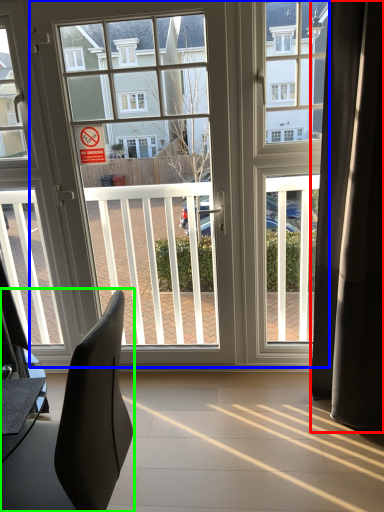
Question: Estimate the real-world distances between objects in this image. Which object is closer to curtain (highlighted by a red box), door (highlighted by a blue box) or chair (highlighted by a green box)?

Choices:
 (A) door
 (B) chair

Answer: (A)